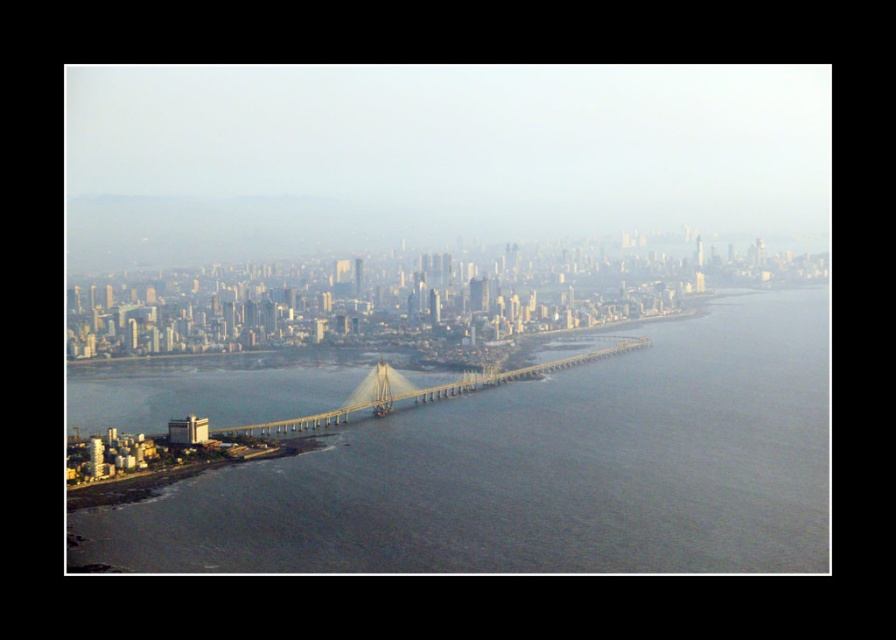
Question: Which point is farther from the camera taking this photo?

Choices:
 (A) click(x=303, y=385)
 (B) click(x=386, y=376)

Answer: (A)

Question: Which point is closer to the camera taking this photo?

Choices:
 (A) (814, 541)
 (B) (244, 426)

Answer: (B)

Question: Which object appears farthest from the camera in this image?

Choices:
 (A) metallic gray bridge at center
 (B) gray concrete bridge at center

Answer: (A)

Question: Can you confirm if gray concrete bridge at center is positioned below metallic gray bridge at center?

Choices:
 (A) no
 (B) yes

Answer: (B)

Question: Does gray concrete bridge at center appear on the right side of metallic gray bridge at center?

Choices:
 (A) yes
 (B) no

Answer: (A)

Question: Where is gray concrete bridge at center located in relation to metallic gray bridge at center in the image?

Choices:
 (A) left
 (B) right

Answer: (B)